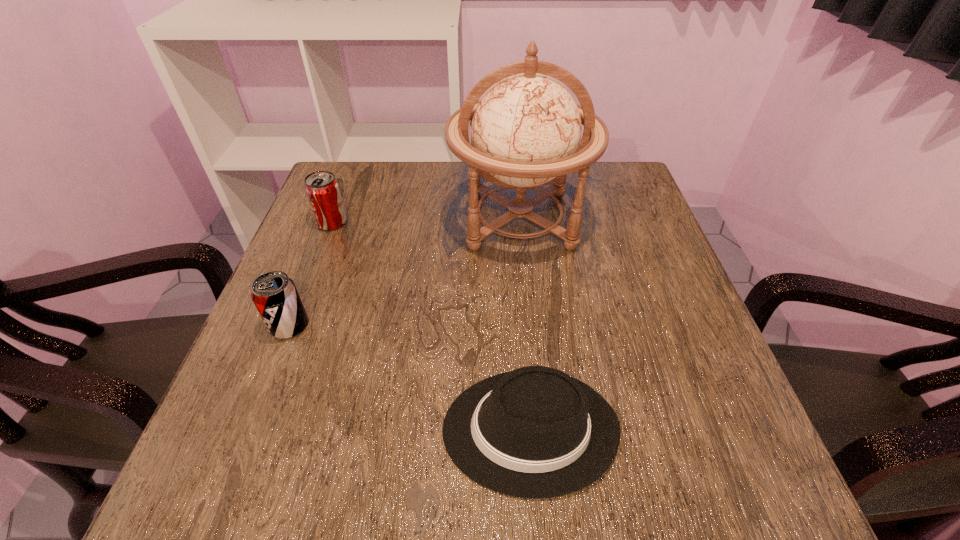
This screenshot has width=960, height=540. I want to click on globe, so click(525, 131).

This screenshot has height=540, width=960. In order to click on the farther soda can in this screenshot , I will do `click(322, 189)`.

You are a GUI agent. You are given a task and a screenshot of the screen. Output one action in this format:
    pyautogui.click(x=<x>, y=<y>)
    Task: Click on the nearer soda can
    
    Given the screenshot: What is the action you would take?
    pyautogui.click(x=274, y=294)

Identify the location of the nearest object. (535, 432).

The height and width of the screenshot is (540, 960). Identify the location of the shortest object. (535, 432).

Identify the location of blank space located on the front-facing side of the globe. (528, 303).

In order to click on blank area located on the front of the farther soda can in this screenshot , I will do `click(295, 321)`.

The width and height of the screenshot is (960, 540). What are the coordinates of `vacant space located 0.150m on the front of the nearer soda can` in the screenshot? It's located at (255, 413).

This screenshot has width=960, height=540. What are the coordinates of `vacant space located on the front-facing side of the nearest object` in the screenshot? It's located at (350, 429).

Where is `free spot located 0.250m on the front-facing side of the nearest object`? The image size is (960, 540). free spot located 0.250m on the front-facing side of the nearest object is located at coordinates (290, 429).